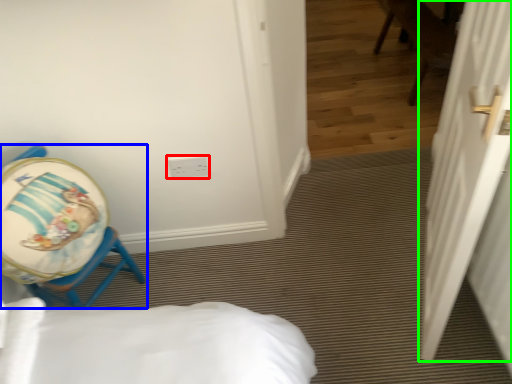
Question: Which object is positioned closest to electric outlet (highlighted by a red box)? Select from chair (highlighted by a blue box) and door (highlighted by a green box).

Choices:
 (A) chair
 (B) door

Answer: (A)